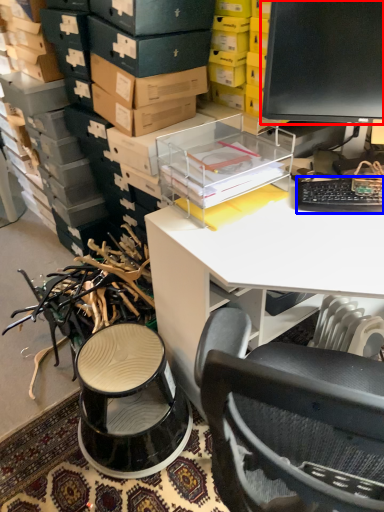
Question: Among these objects, which one is nearest to the camera, computer monitor (highlighted by a red box) or computer keyboard (highlighted by a blue box)?

Choices:
 (A) computer monitor
 (B) computer keyboard

Answer: (A)